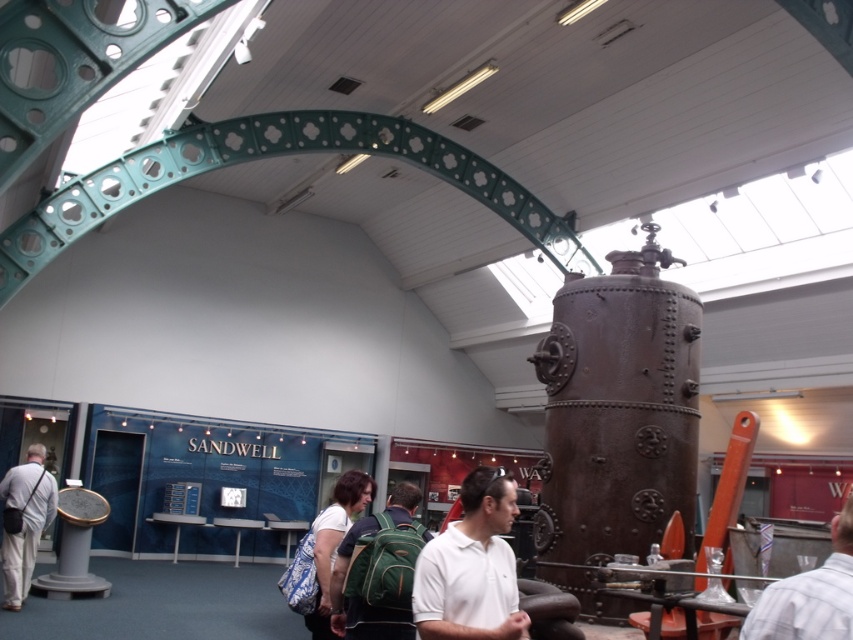
Question: Based on their relative distances, which object is nearer to the striped shirt at center?

Choices:
 (A) white matte shirt at center
 (B) green fabric backpack at center

Answer: (A)

Question: Is green fabric backpack at center bigger than light gray fabric jacket at left?

Choices:
 (A) no
 (B) yes

Answer: (A)

Question: Does green fabric backpack at center have a smaller size compared to striped shirt at center?

Choices:
 (A) yes
 (B) no

Answer: (B)

Question: Which point is closer to the camera taking this photo?

Choices:
 (A) (419, 579)
 (B) (329, 586)
 (C) (42, 506)

Answer: (A)

Question: Based on their relative distances, which object is nearer to the light gray fabric jacket at left?

Choices:
 (A) striped shirt at center
 (B) white matte shirt at center

Answer: (B)

Question: Considering the relative positions of white matte shirt at center and striped shirt at center in the image provided, where is white matte shirt at center located with respect to striped shirt at center?

Choices:
 (A) below
 (B) above

Answer: (A)